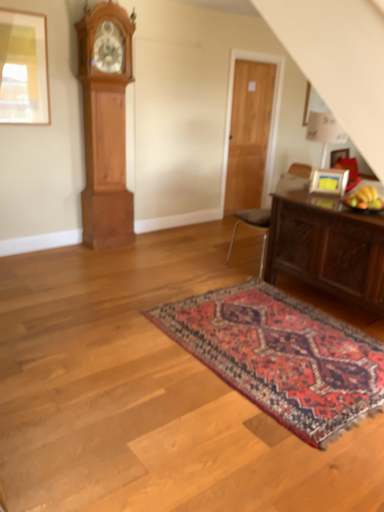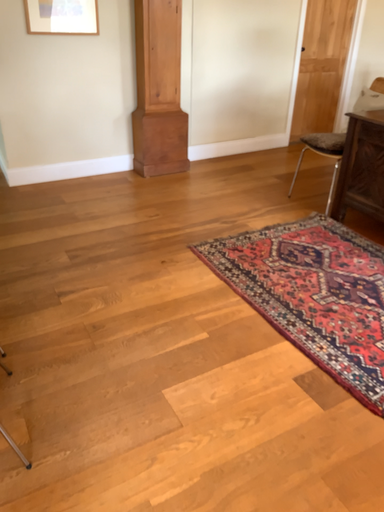
Question: How did the camera likely rotate when shooting the video?

Choices:
 (A) rotated downward
 (B) rotated upward

Answer: (A)